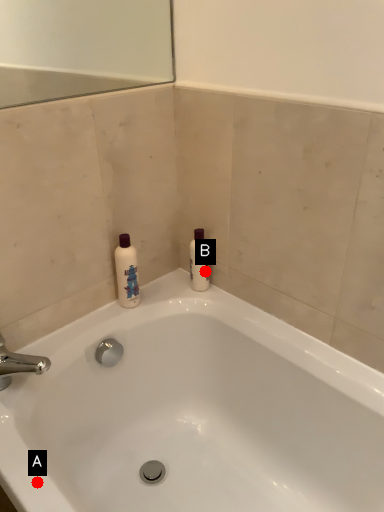
Question: Two points are circled on the image, labeled by A and B beside each circle. Which point is further to the camera?

Choices:
 (A) A is further
 (B) B is further

Answer: (B)